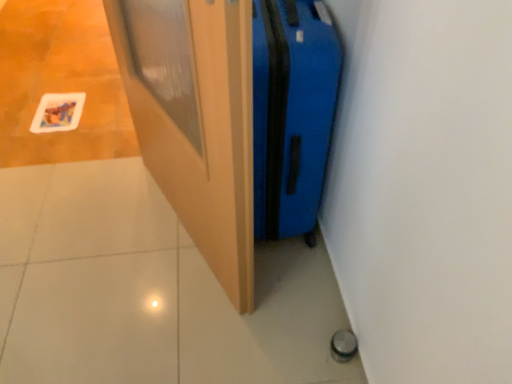
Describe the element at coordinates (196, 120) in the screenshot. I see `wooden door at center` at that location.

Measure the distance between wooden door at center and camera.

wooden door at center is 25.61 inches from camera.

Identify the location of wooden door at center. Image resolution: width=512 pixels, height=384 pixels. (196, 120).

Image resolution: width=512 pixels, height=384 pixels. What do you see at coordinates (292, 112) in the screenshot? I see `blue hardshell suitcase at center-right` at bounding box center [292, 112].

Find the location of `blue hardshell suitcase at center-right`. blue hardshell suitcase at center-right is located at coordinates (292, 112).

At what (x,y) coordinates should I click in order to perform the action: click on wooden door at center. Please return your answer as a coordinate pair (x, y). The height and width of the screenshot is (384, 512). Looking at the image, I should click on (196, 120).

Is wooden door at center to the right of blue hardshell suitcase at center-right from the viewer's perspective?

In fact, wooden door at center is to the left of blue hardshell suitcase at center-right.

Is wooden door at center positioned behind blue hardshell suitcase at center-right?

That is False.

Does point (187, 202) come closer to viewer compared to point (268, 139)?

No, (187, 202) is further to viewer.

From the image's perspective, would you say wooden door at center is shown under blue hardshell suitcase at center-right?

Yes.

From a real-world perspective, who is located lower, wooden door at center or blue hardshell suitcase at center-right?

From a 3D spatial view, blue hardshell suitcase at center-right is below.

Does wooden door at center have a greater width compared to blue hardshell suitcase at center-right?

Incorrect, the width of wooden door at center does not surpass that of blue hardshell suitcase at center-right.

Based on the photo, is wooden door at center taller or shorter than blue hardshell suitcase at center-right?

wooden door at center is taller than blue hardshell suitcase at center-right.

Who is smaller, wooden door at center or blue hardshell suitcase at center-right?

wooden door at center is smaller.

Would you say wooden door at center is inside or outside blue hardshell suitcase at center-right?

wooden door at center exists outside the volume of blue hardshell suitcase at center-right.

Are wooden door at center and blue hardshell suitcase at center-right beside each other?

No, wooden door at center is not making contact with blue hardshell suitcase at center-right.

Is wooden door at center looking in the opposite direction of blue hardshell suitcase at center-right?

Absolutely, wooden door at center is directed away from blue hardshell suitcase at center-right.

What's the angular difference between wooden door at center and blue hardshell suitcase at center-right's facing directions?

They differ by 23.8 degrees in their facing directions.

In order to click on luggage located behind the wooden door at center in this screenshot , I will do `click(292, 112)`.

Considering the positions of objects blue hardshell suitcase at center-right and wooden door at center in the image provided, who is more to the right, blue hardshell suitcase at center-right or wooden door at center?

Positioned to the right is blue hardshell suitcase at center-right.

Does blue hardshell suitcase at center-right come behind wooden door at center?

Yes, it is behind wooden door at center.

Does point (294, 37) lie behind point (163, 178)?

No, (294, 37) is in front of (163, 178).

From the image's perspective, who appears lower, blue hardshell suitcase at center-right or wooden door at center?

wooden door at center.

From a real-world perspective, which object rests below the other?

blue hardshell suitcase at center-right.

Is blue hardshell suitcase at center-right thinner than wooden door at center?

In fact, blue hardshell suitcase at center-right might be wider than wooden door at center.

Between blue hardshell suitcase at center-right and wooden door at center, which one has less height?

blue hardshell suitcase at center-right is shorter.

Based on their sizes in the image, would you say blue hardshell suitcase at center-right is bigger or smaller than wooden door at center?

blue hardshell suitcase at center-right is bigger than wooden door at center.

Could wooden door at center be considered to be inside blue hardshell suitcase at center-right?

That's incorrect, wooden door at center is not inside blue hardshell suitcase at center-right.

In the scene shown: Can you see blue hardshell suitcase at center-right touching wooden door at center?

No, blue hardshell suitcase at center-right is not with wooden door at center.

Is blue hardshell suitcase at center-right looking in the opposite direction of wooden door at center?

Yes, blue hardshell suitcase at center-right is facing away from wooden door at center.

How different are the orientations of blue hardshell suitcase at center-right and wooden door at center in degrees?

They differ by 23.8 degrees in their facing directions.

How much distance is there between blue hardshell suitcase at center-right and wooden door at center?

blue hardshell suitcase at center-right is 10.67 inches from wooden door at center.

Find the location of a particular element. The height and width of the screenshot is (384, 512). luggage above the wooden door at center (from the image's perspective) is located at coordinates (292, 112).

The height and width of the screenshot is (384, 512). I want to click on door located below the blue hardshell suitcase at center-right (from the image's perspective), so click(196, 120).

Identify the location of luggage behind the wooden door at center. Image resolution: width=512 pixels, height=384 pixels. (292, 112).